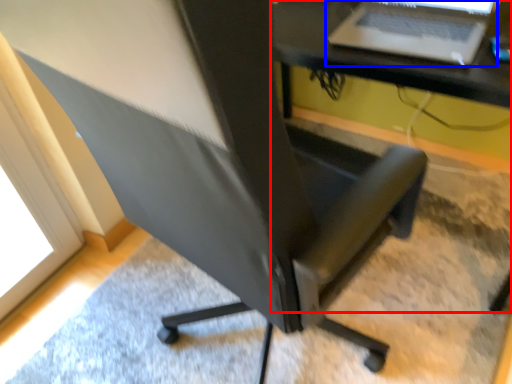
Question: Among these objects, which one is nearest to the camera, computer desk (highlighted by a red box) or laptop (highlighted by a blue box)?

Choices:
 (A) computer desk
 (B) laptop

Answer: (A)